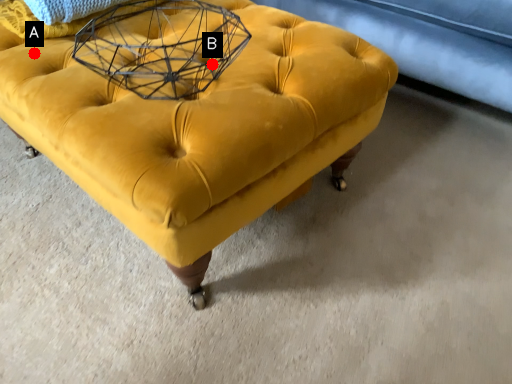
Question: Two points are circled on the image, labeled by A and B beside each circle. Which point appears closest to the camera in this image?

Choices:
 (A) A is closer
 (B) B is closer

Answer: (B)